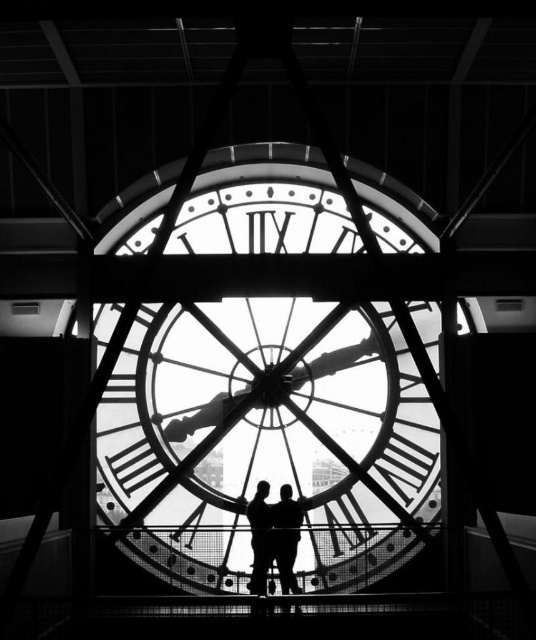
You are an architect designing a new public space and want to place a bench for visitors to admire the clock. The bench must be wide enough to accommodate both the black matte couple at center and the silhouette figure at center sitting side by side. Based on the scene, will the bench need to be wider than the combined width of the two figures?

The black matte couple at center is wider than the silhouette figure at center. Therefore, the bench must be at least as wide as the combined width of both figures to accommodate them sitting side by side. Since the exact combined width isn